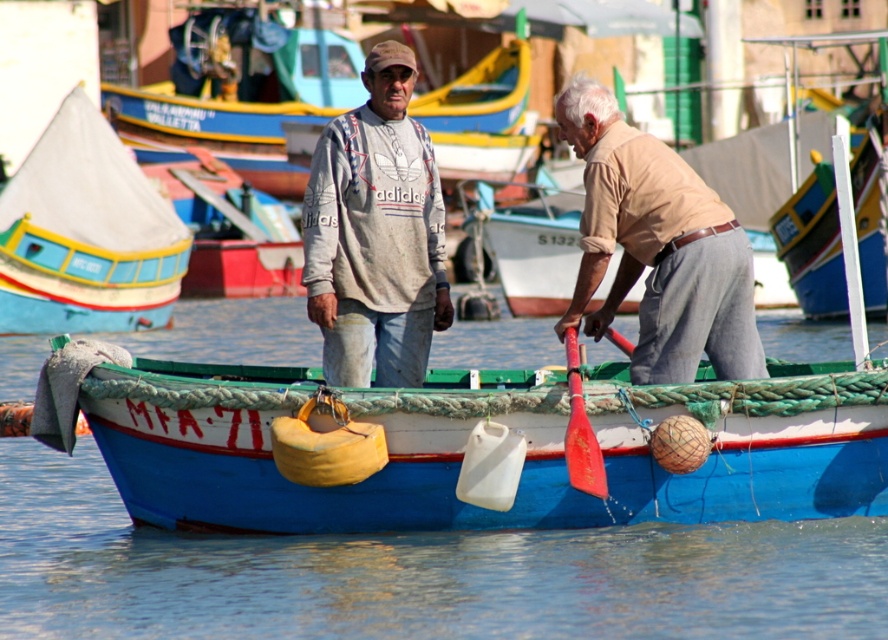
Can you confirm if gray cotton sweatshirt at center is shorter than matte blue boat at left?

No, gray cotton sweatshirt at center is not shorter than matte blue boat at left.

Between point (331, 362) and point (113, 209), which one is positioned in front?

Point (331, 362)

Where is `gray cotton sweatshirt at center`? The image size is (888, 640). gray cotton sweatshirt at center is located at coordinates (375, 234).

Is point (377, 227) farther from camera compared to point (291, 227)?

No, (377, 227) is closer to viewer.

What do you see at coordinates (375, 234) in the screenshot?
I see `gray cotton sweatshirt at center` at bounding box center [375, 234].

I want to click on gray cotton sweatshirt at center, so click(x=375, y=234).

Who is lower down, wooden boat at upper center or matte brown boat at center?

matte brown boat at center is lower down.

The image size is (888, 640). Describe the element at coordinates (236, 100) in the screenshot. I see `wooden boat at upper center` at that location.

What do you see at coordinates (236, 100) in the screenshot? I see `wooden boat at upper center` at bounding box center [236, 100].

Where is `wooden boat at upper center`? This screenshot has width=888, height=640. wooden boat at upper center is located at coordinates (236, 100).